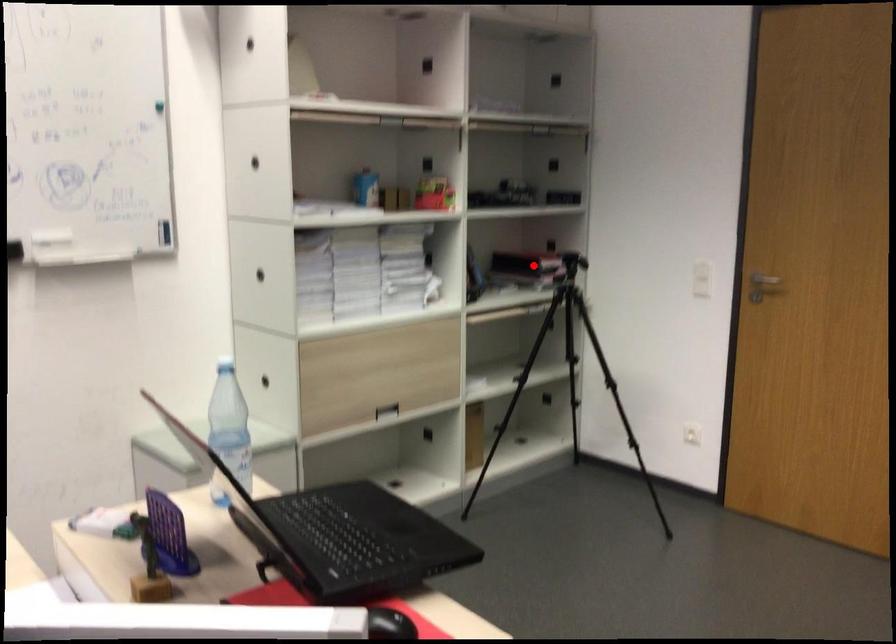
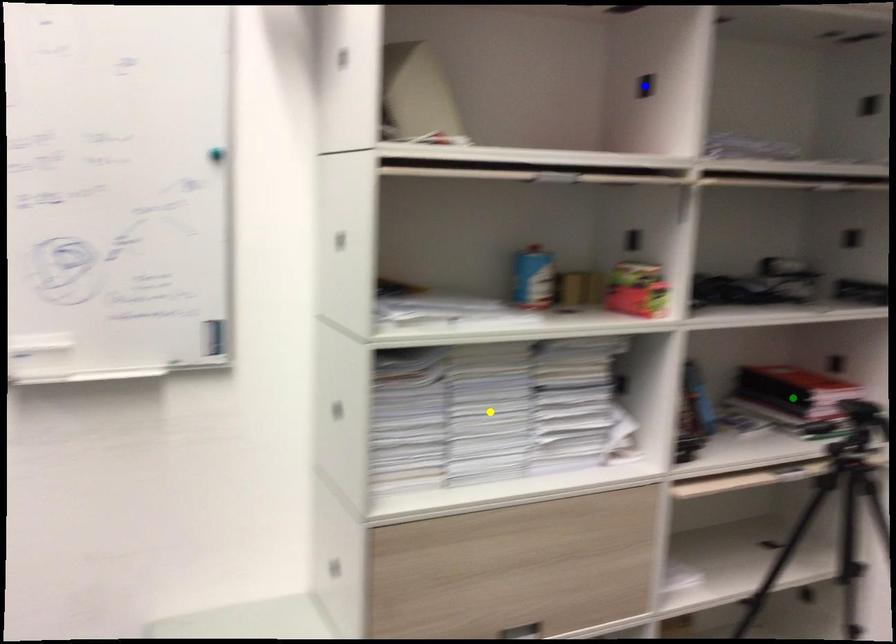
Question: I am providing you with two images of the same scene from different viewpoints. A red point is marked on the first image. You are given multiple points on the second image. In image 2, which mark is for the same physical point as the one in image 1?

Choices:
 (A) yellow point
 (B) blue point
 (C) green point

Answer: (C)